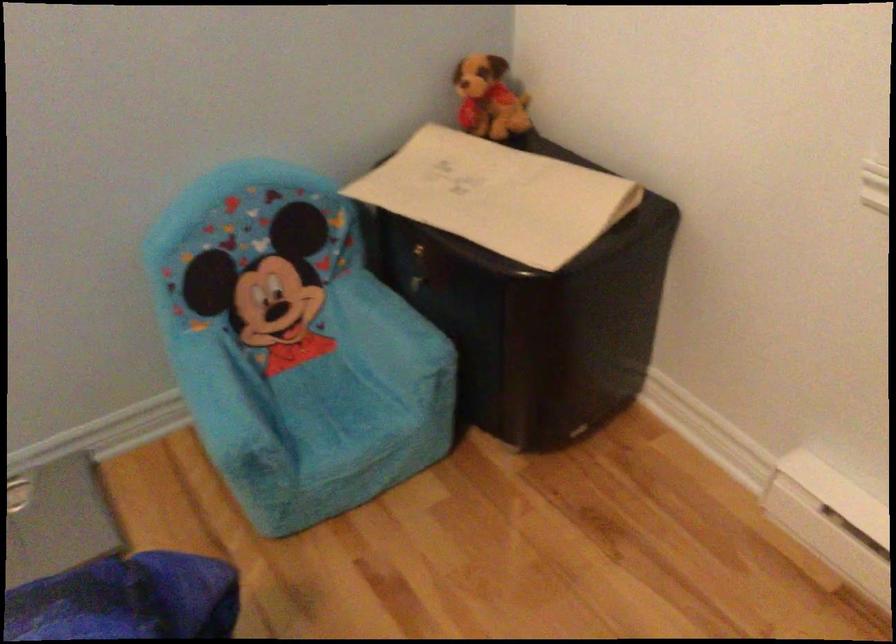
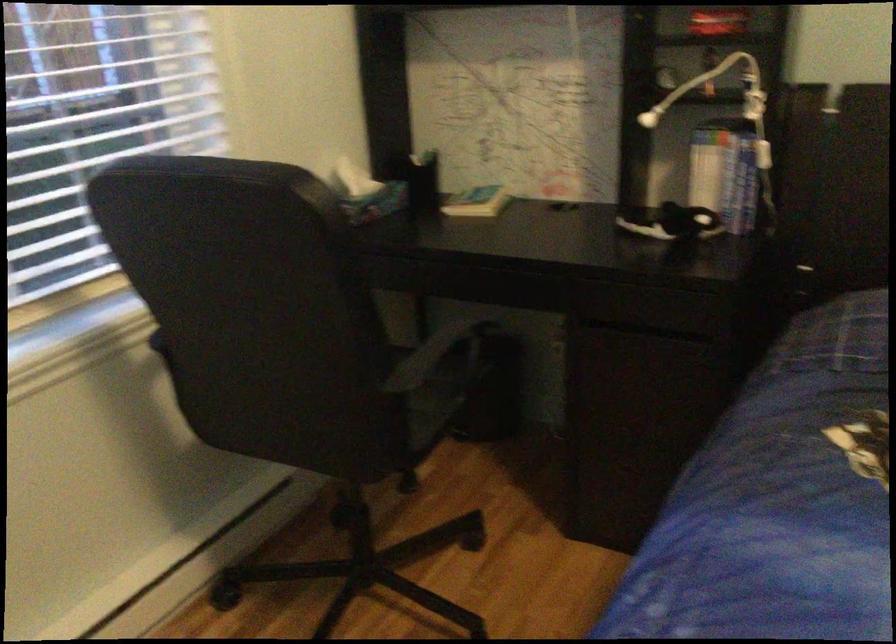
The images are taken continuously from a first-person perspective. In which direction is your viewpoint rotating?

The camera's rotation is toward right-down.